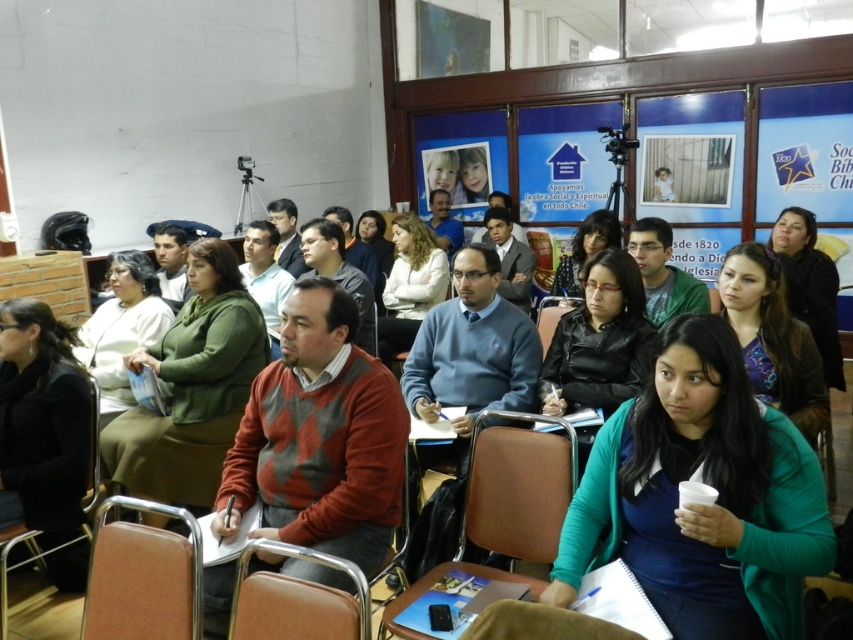
You are attending a meeting in this conference room and need to choose a seat. You want to sit in a chair that is larger in size. Which chair should you choose between the brown wood chair at center and the brown leather chair at center?

The brown wood chair at center is larger in size than the brown leather chair at center, so you should choose the brown wood chair at center.

You are standing at the entrance of the conference room and want to sit in the brown leather chair at lower left. According to the coordinates provided, in which direction should you walk to reach it?

The brown leather chair at lower left is located at coordinates point [142,577]. Since the coordinate system is not specified, but typically in such contexts, the lower left corner is considered as the origin point. Therefore, you should walk towards the lower left direction to reach the brown leather chair at lower left.